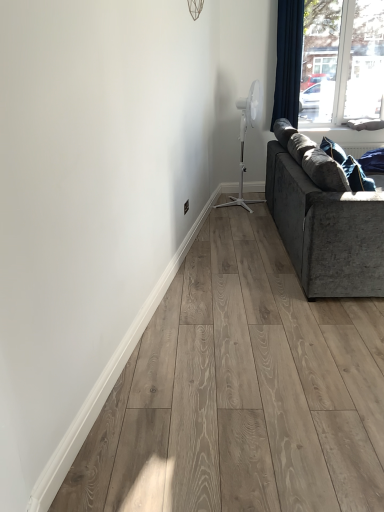
Question: Is white plastic fan at upper right shorter than velvet grey couch at right?

Choices:
 (A) no
 (B) yes

Answer: (A)

Question: From the image's perspective, does white plastic fan at upper right appear lower than velvet grey couch at right?

Choices:
 (A) no
 (B) yes

Answer: (A)

Question: From a real-world perspective, is white plastic fan at upper right located beneath velvet grey couch at right?

Choices:
 (A) no
 (B) yes

Answer: (A)

Question: Is white plastic fan at upper right at the right side of velvet grey couch at right?

Choices:
 (A) yes
 (B) no

Answer: (B)

Question: Can you confirm if white plastic fan at upper right is thinner than velvet grey couch at right?

Choices:
 (A) yes
 (B) no

Answer: (A)

Question: In the image, is white plastic fan at upper right positioned in front of or behind transparent glass window at upper right?

Choices:
 (A) front
 (B) behind

Answer: (A)

Question: Is point (240, 204) positioned closer to the camera than point (350, 84)?

Choices:
 (A) closer
 (B) farther

Answer: (A)

Question: Is white plastic fan at upper right to the left or to the right of transparent glass window at upper right in the image?

Choices:
 (A) right
 (B) left

Answer: (B)

Question: Is white plastic fan at upper right wider or thinner than transparent glass window at upper right?

Choices:
 (A) thin
 (B) wide

Answer: (B)

Question: Relative to velvet grey couch at right, is denim pillow at lower right in front or behind?

Choices:
 (A) front
 (B) behind

Answer: (B)

Question: In terms of size, does denim pillow at lower right appear bigger or smaller than velvet grey couch at right?

Choices:
 (A) big
 (B) small

Answer: (B)

Question: Does point (349, 166) appear closer or farther from the camera than point (292, 236)?

Choices:
 (A) farther
 (B) closer

Answer: (B)

Question: Would you say denim pillow at lower right is to the left or to the right of velvet grey couch at right in the picture?

Choices:
 (A) left
 (B) right

Answer: (A)

Question: Does point (370, 187) appear closer or farther from the camera than point (324, 24)?

Choices:
 (A) farther
 (B) closer

Answer: (B)

Question: In terms of width, does denim pillow at lower right look wider or thinner when compared to transparent glass window at upper right?

Choices:
 (A) wide
 (B) thin

Answer: (A)